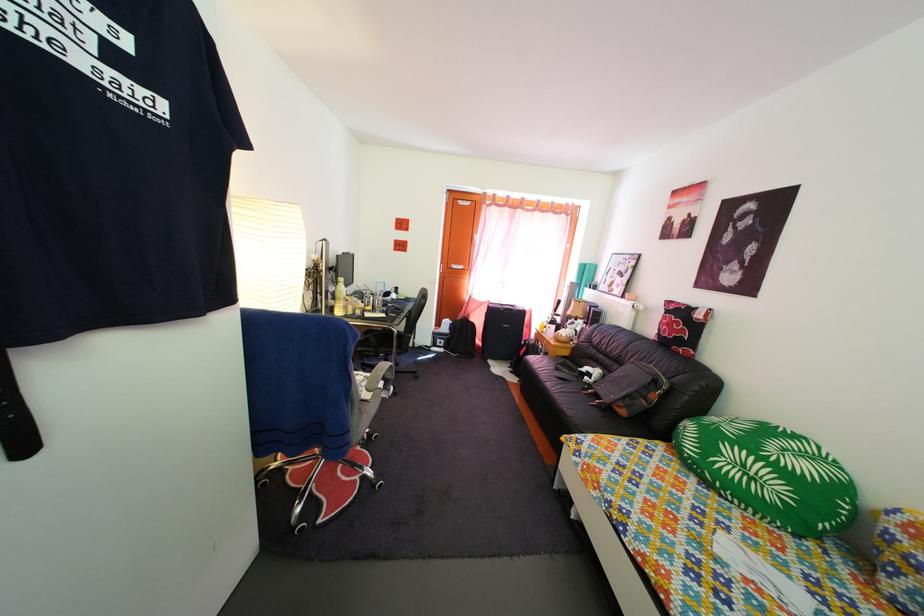
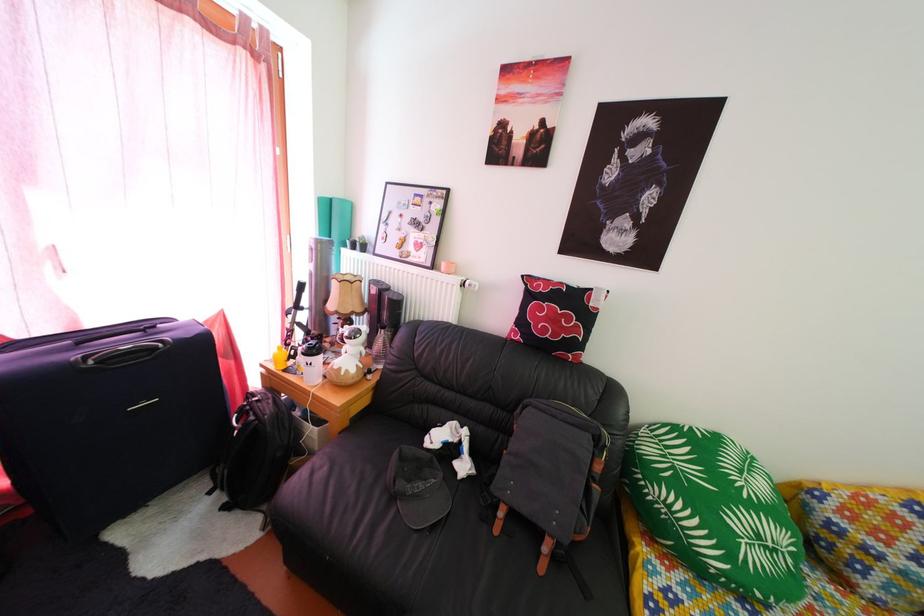
Where in the second image is the point corresponding to (x=762, y=487) from the first image?

(784, 560)